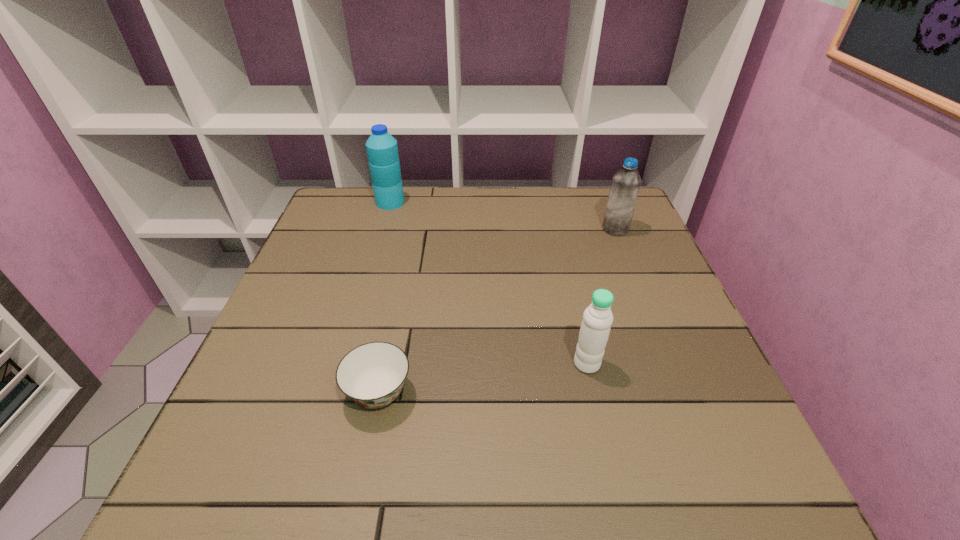
Identify which water bottle is the nearest to the soup bowl. Please provide its 2D coordinates. Your answer should be formatted as a tuple, i.e. [(x, y)], where the tuple contains the x and y coordinates of a point satisfying the conditions above.

[(597, 318)]

Choose which water bottle is the third nearest neighbor to the shortest object. Please provide its 2D coordinates. Your answer should be formatted as a tuple, i.e. [(x, y)], where the tuple contains the x and y coordinates of a point satisfying the conditions above.

[(625, 185)]

Find the location of a particular element. vacant region that satisfies the following two spatial constraints: 1. on the front side of the second farthest object; 2. on the left side of the farthest water bottle is located at coordinates (382, 229).

I want to click on vacant space that satisfies the following two spatial constraints: 1. on the front side of the leftmost water bottle; 2. on the left side of the nearest water bottle, so click(x=344, y=363).

Identify the location of free location that satisfies the following two spatial constraints: 1. on the front side of the second water bottle from left to right; 2. on the right side of the leftmost water bottle. (344, 363).